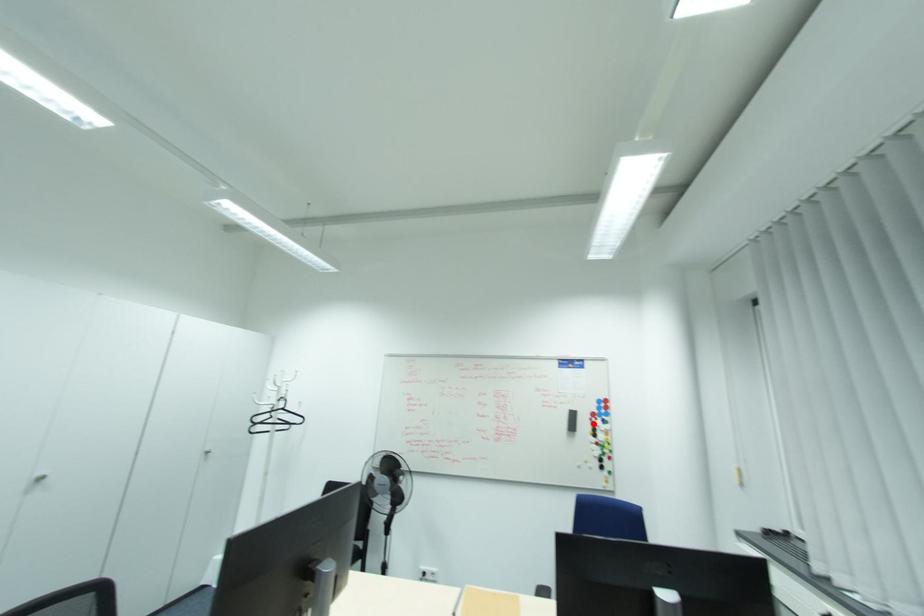
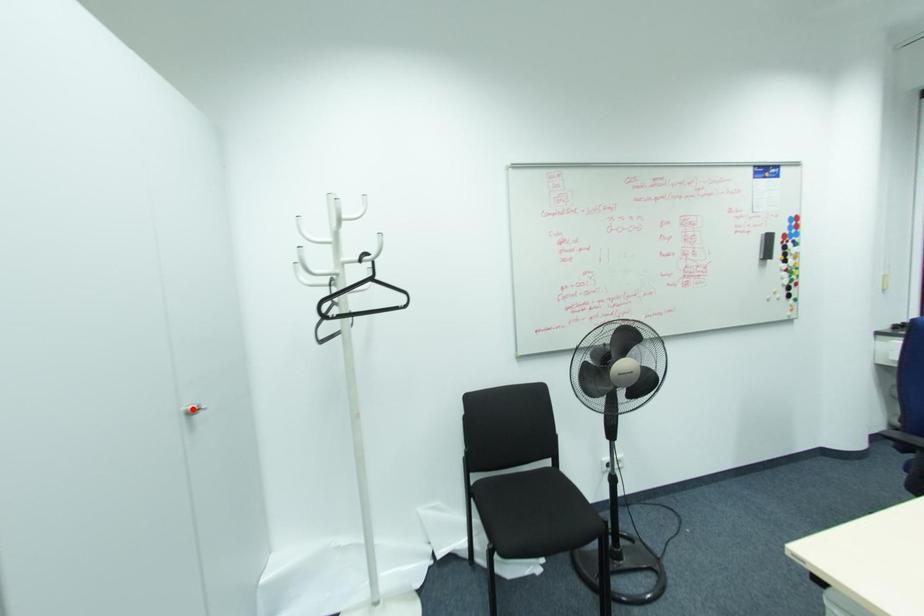
I am providing you with two images of the same scene from different viewpoints. A red point is marked on the first image and another point is marked on the second image. Are the points marked in image1 and image2 representing the same 3D position?

No